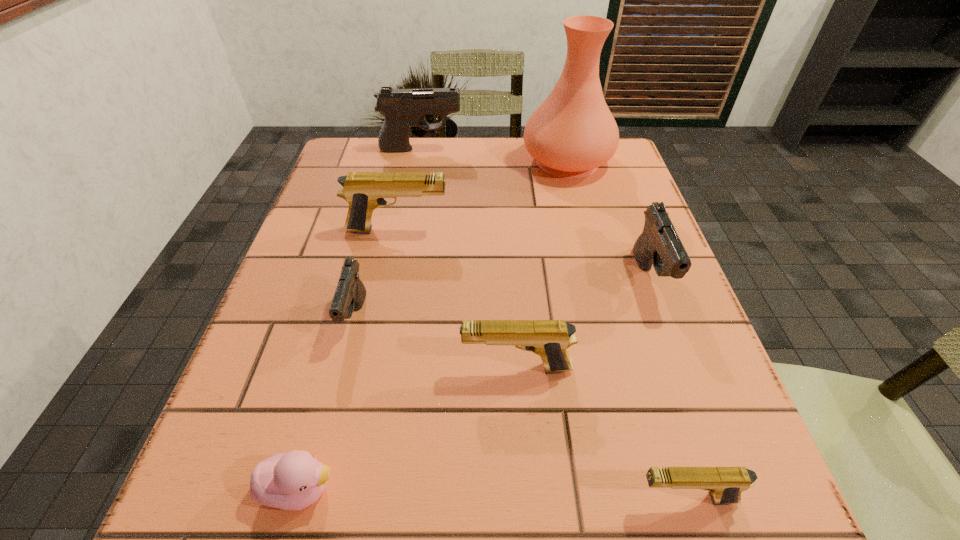
The height and width of the screenshot is (540, 960). I want to click on free point located 0.120m on the front-facing side of the pink duckling, so click(433, 489).

Where is `vacant area situated 0.300m at the barrel of the nearest pistol`? vacant area situated 0.300m at the barrel of the nearest pistol is located at coordinates (407, 498).

Locate an element on the screen. The image size is (960, 540). vacant point located at the barrel of the nearest pistol is located at coordinates (581, 498).

Locate an element on the screen. This screenshot has width=960, height=540. free space located at the barrel of the nearest pistol is located at coordinates (422, 498).

Locate an element on the screen. The height and width of the screenshot is (540, 960). vase located in the far edge section of the desktop is located at coordinates (572, 133).

Locate an element on the screen. pistol positioned at the far edge is located at coordinates (402, 108).

Locate an element on the screen. This screenshot has width=960, height=540. duckling at the near edge is located at coordinates (289, 481).

At what (x,y) coordinates should I click in order to perform the action: click on pistol that is at the near edge. Please return your answer as a coordinate pair (x, y). The height and width of the screenshot is (540, 960). Looking at the image, I should click on (725, 484).

Locate an element on the screen. duckling present at the left edge is located at coordinates (289, 481).

You are a GUI agent. You are given a task and a screenshot of the screen. Output one action in this format:
    pyautogui.click(x=<x>, y=<y>)
    Task: Click on the vase at the right edge
    The width and height of the screenshot is (960, 540).
    Given the screenshot: What is the action you would take?
    pyautogui.click(x=572, y=133)